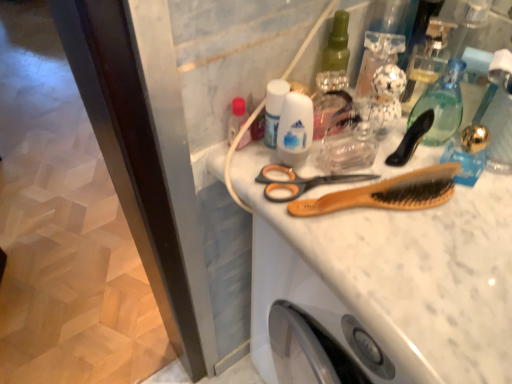
Question: In terms of width, does translucent glass mouthwash at upper right, the 2th mouthwash when ordered from left to right, look wider or thinner when compared to white glossy mouthwash at center, which appears as the 2th mouthwash when viewed from the right?

Choices:
 (A) wide
 (B) thin

Answer: (A)

Question: From a real-world perspective, is translucent glass mouthwash at upper right, the 2th mouthwash when ordered from left to right, physically located above or below white glossy mouthwash at center, which appears as the 2th mouthwash when viewed from the right?

Choices:
 (A) below
 (B) above

Answer: (B)

Question: Considering the real-world distances, which object is closest to the white matte deodorant at center, the 2th toiletry in the left-to-right sequence?

Choices:
 (A) black plastic brush at upper right
 (B) matte plastic bottle at upper left, the first toiletry viewed from the left
 (C) wooden comb at center
 (D) white marble counter top at upper right
 (E) orange plastic scissors at center

Answer: (E)

Question: Which is farther from the black plastic brush at upper right?

Choices:
 (A) white glossy mouthwash at center, which appears as the 1th mouthwash when viewed from the left
 (B) wooden comb at center
 (C) white marble counter top at upper right
 (D) translucent glass mouthwash at upper right, the 2th mouthwash when ordered from left to right
 (E) orange plastic scissors at center

Answer: (A)